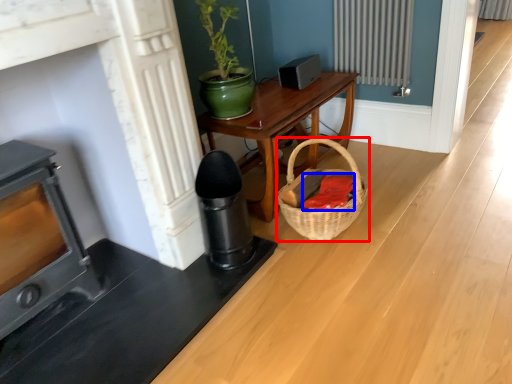
Question: Which object appears closest to the camera in this image, basket (highlighted by a red box) or material (highlighted by a blue box)?

Choices:
 (A) basket
 (B) material

Answer: (A)